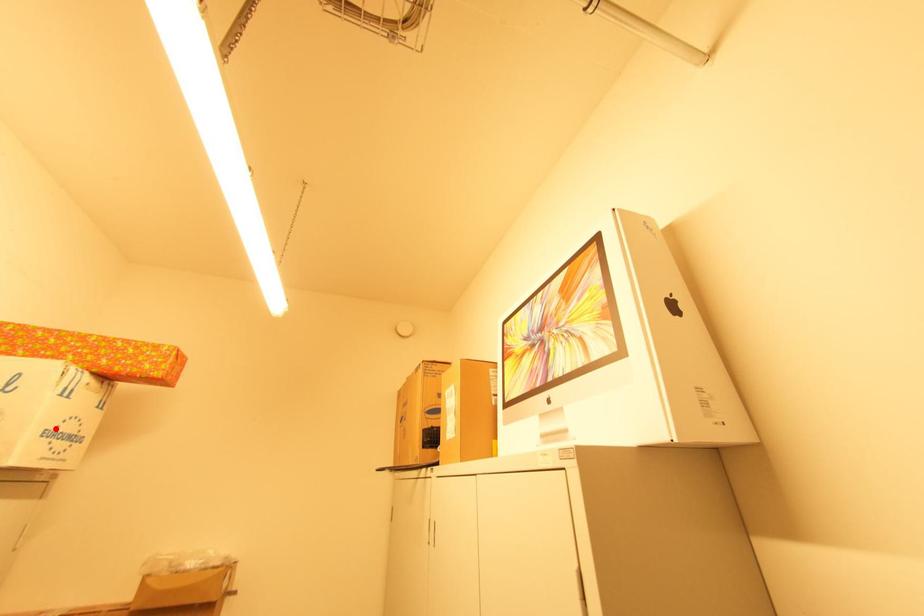
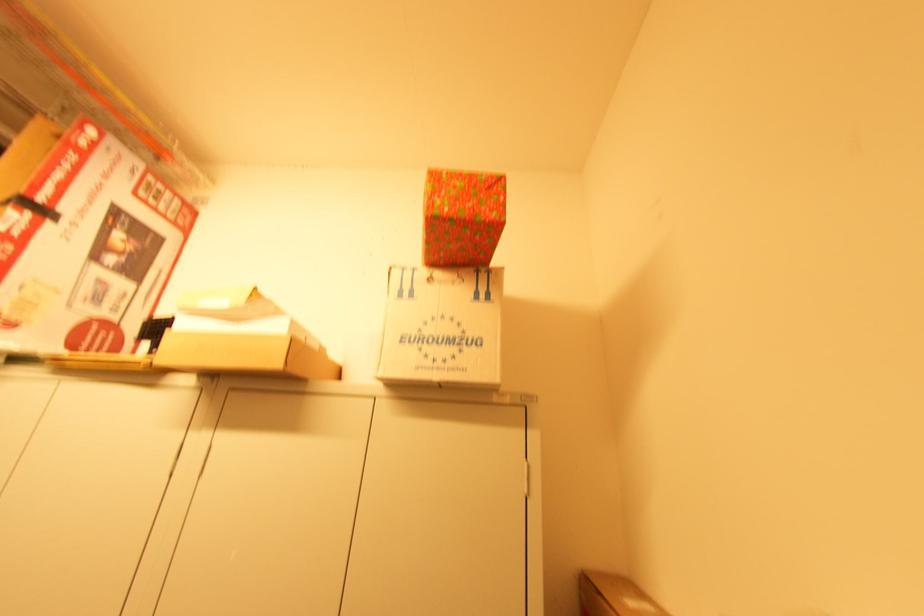
Question: I am providing you with two images of the same scene from different viewpoints. A red point is marked on the first image. Can you still see the location of the red point in image 2?

Choices:
 (A) Yes
 (B) No

Answer: (A)